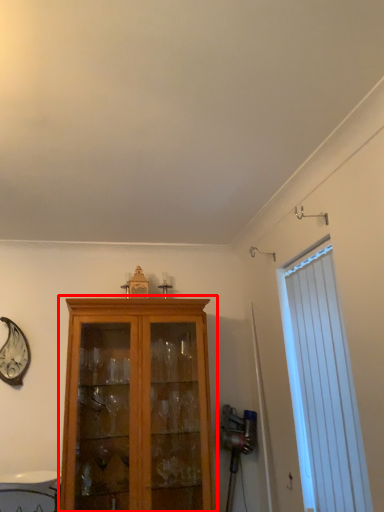
Question: From the image's perspective, where is cupboard (annotated by the red box) located relative to window?

Choices:
 (A) above
 (B) below

Answer: (B)